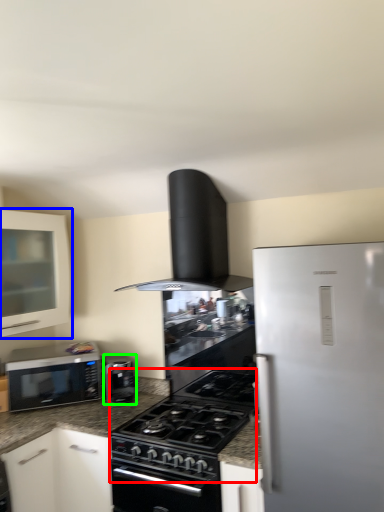
Question: Which object is the farthest from gas stove (highlighted by a red box)? Choose among these: cabinetry (highlighted by a blue box) or kitchen appliance (highlighted by a green box).

Choices:
 (A) cabinetry
 (B) kitchen appliance

Answer: (A)